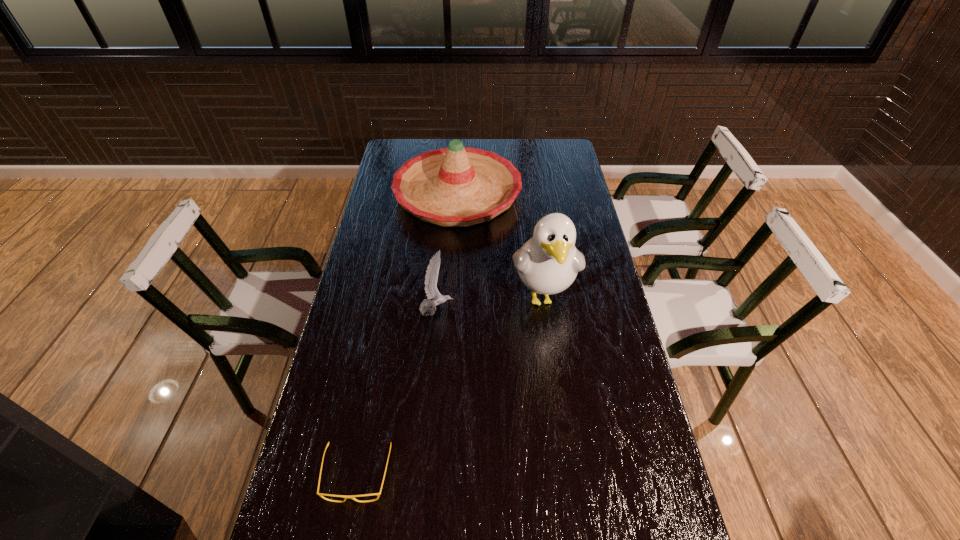
At what (x,y) coordinates should I click in order to perform the action: click on free space between the third tallest object and the farthest object. Please return your answer as a coordinate pair (x, y). Image resolution: width=960 pixels, height=540 pixels. Looking at the image, I should click on (447, 252).

The height and width of the screenshot is (540, 960). Find the location of `vacant area that lies between the spectacles and the third tallest object`. vacant area that lies between the spectacles and the third tallest object is located at coordinates (396, 393).

Where is `vacant area that lies between the second shortest object and the sombrero`? The height and width of the screenshot is (540, 960). vacant area that lies between the second shortest object and the sombrero is located at coordinates (447, 252).

Identify the location of free space between the shorter gull and the farthest object. (447, 252).

The image size is (960, 540). I want to click on free space between the taller gull and the spectacles, so click(x=450, y=385).

Locate an element on the screen. free space between the shorter gull and the second tallest object is located at coordinates (447, 252).

This screenshot has height=540, width=960. I want to click on vacant area that lies between the farthest object and the left gull, so point(447,252).

At what (x,y) coordinates should I click in order to perform the action: click on free spot between the spectacles and the second tallest object. Please return your answer as a coordinate pair (x, y). This screenshot has width=960, height=540. Looking at the image, I should click on (407, 334).

Where is `free spot between the sombrero and the nearest object`? This screenshot has width=960, height=540. free spot between the sombrero and the nearest object is located at coordinates (407, 334).

I want to click on free space that is in between the third tallest object and the farthest object, so coord(447,252).